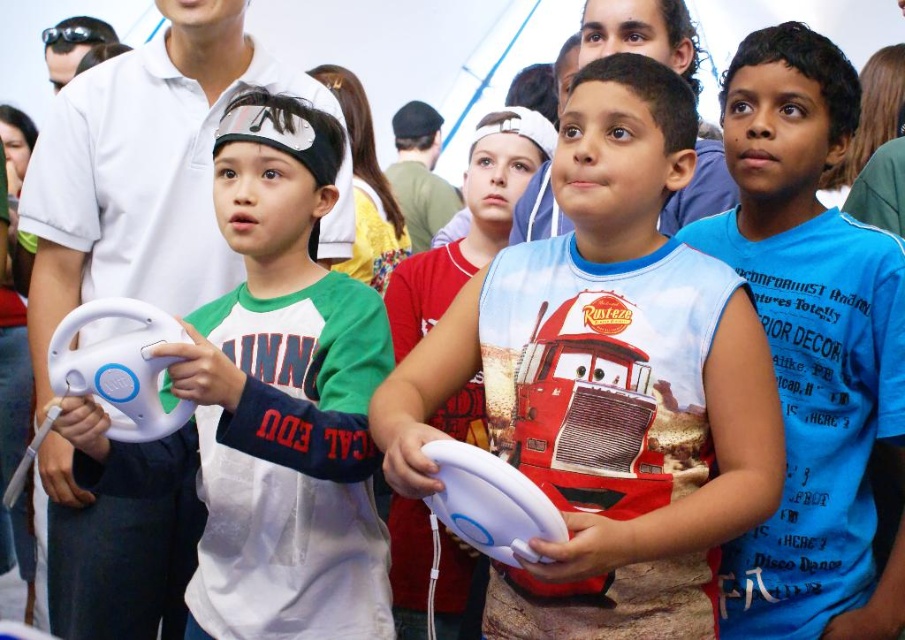
Question: Can you confirm if white matte controller at center is smaller than blue cotton shirt at center?

Choices:
 (A) no
 (B) yes

Answer: (A)

Question: Which object is farther from the camera taking this photo?

Choices:
 (A) white matte steering wheel at left
 (B) blue cotton shirt at center

Answer: (B)

Question: Which object is closer to the camera taking this photo?

Choices:
 (A) blue cotton shirt at center
 (B) white matte controller at center
 (C) white matte steering wheel at left

Answer: (B)

Question: Is the position of white matte controller at center less distant than that of white matte steering wheel at left?

Choices:
 (A) yes
 (B) no

Answer: (A)

Question: Estimate the real-world distances between objects in this image. Which object is farther from the white matte controller at center?

Choices:
 (A) blue cotton shirt at center
 (B) white matte steering wheel at left

Answer: (B)

Question: Does white matte controller at center have a lesser width compared to white matte steering wheel at left?

Choices:
 (A) no
 (B) yes

Answer: (A)